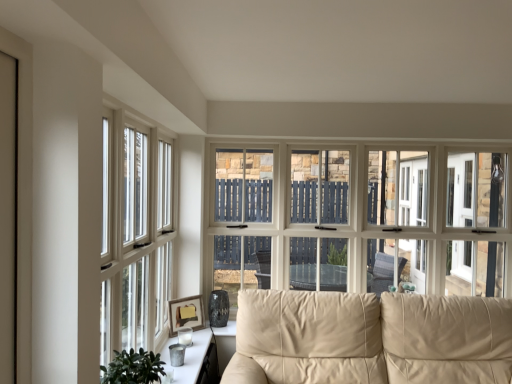
Question: Is white wood window at left, placed as the 2th window when sorted from back to front, surrounded by beige leather couch at center?

Choices:
 (A) no
 (B) yes

Answer: (A)

Question: Can you confirm if beige leather couch at center is shorter than white wood window at left, acting as the second window starting from the right?

Choices:
 (A) yes
 (B) no

Answer: (A)

Question: Is beige leather couch at center to the left of white wood window at left, which is counted as the first window, starting from the left, from the viewer's perspective?

Choices:
 (A) yes
 (B) no

Answer: (B)

Question: Can you confirm if beige leather couch at center is thinner than white wood window at left, which is counted as the first window, starting from the left?

Choices:
 (A) yes
 (B) no

Answer: (B)

Question: Is beige leather couch at center positioned behind white wood window at left, which is counted as the first window, starting from the left?

Choices:
 (A) no
 (B) yes

Answer: (B)

Question: In the image, is white wood window at left, placed as the 2th window when sorted from back to front, on the left side or the right side of matte white window at center, which appears as the 1th window when viewed from the right?

Choices:
 (A) right
 (B) left

Answer: (B)

Question: Is white wood window at left, placed as the 2th window when sorted from back to front, inside or outside of matte white window at center, arranged as the 2th window when viewed from the front?

Choices:
 (A) inside
 (B) outside

Answer: (B)

Question: Considering the positions of white wood window at left, placed as the 2th window when sorted from back to front, and matte white window at center, arranged as the 2th window when viewed from the front, in the image, is white wood window at left, placed as the 2th window when sorted from back to front, bigger or smaller than matte white window at center, arranged as the 2th window when viewed from the front,?

Choices:
 (A) small
 (B) big

Answer: (A)

Question: Is white wood window at left, placed as the 2th window when sorted from back to front, wider or thinner than matte white window at center, the 1th window in the back-to-front sequence?

Choices:
 (A) wide
 (B) thin

Answer: (B)

Question: Visually, is matte wooden picture frame at lower left positioned to the left or to the right of metallic silver tray at lower center?

Choices:
 (A) left
 (B) right

Answer: (A)

Question: Based on their sizes in the image, would you say matte wooden picture frame at lower left is bigger or smaller than metallic silver tray at lower center?

Choices:
 (A) big
 (B) small

Answer: (B)

Question: From the image's perspective, is matte wooden picture frame at lower left positioned above or below metallic silver tray at lower center?

Choices:
 (A) below
 (B) above

Answer: (B)

Question: Considering their positions, is matte wooden picture frame at lower left located in front of or behind metallic silver tray at lower center?

Choices:
 (A) behind
 (B) front

Answer: (A)

Question: From the image's perspective, is metallic silver tray at lower center located above or below matte white window at center, arranged as the 2th window when viewed from the front?

Choices:
 (A) below
 (B) above

Answer: (A)

Question: Considering their positions, is metallic silver tray at lower center located in front of or behind matte white window at center, which is counted as the 2th window, starting from the left?

Choices:
 (A) front
 (B) behind

Answer: (A)